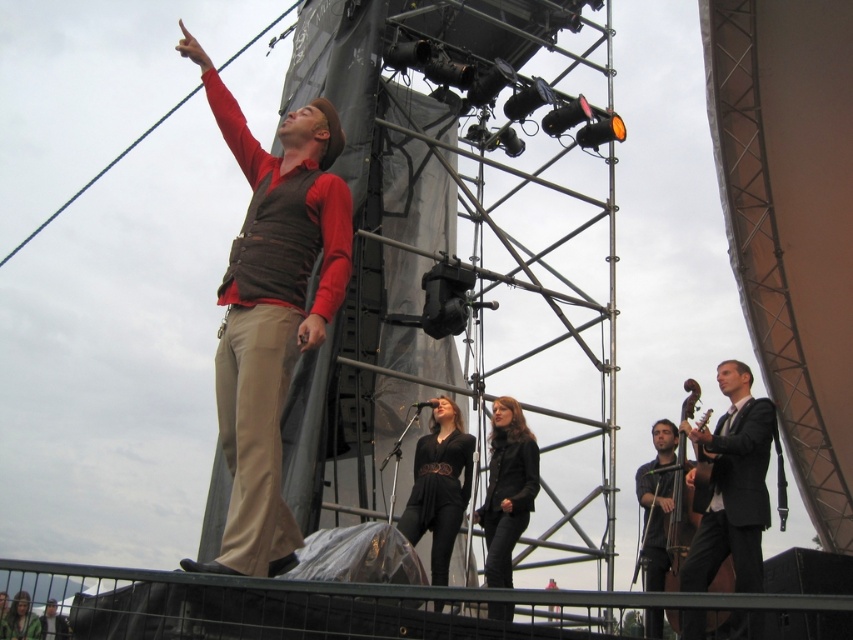
Question: Is matte brown vest at upper left behind black suit at right?

Choices:
 (A) no
 (B) yes

Answer: (A)

Question: Which point is closer to the camera taking this photo?

Choices:
 (A) (257, 554)
 (B) (32, 630)
 (C) (403, 529)
 (D) (675, 522)

Answer: (A)

Question: Does black suit at right appear on the right side of dark brown wood cello at lower right?

Choices:
 (A) yes
 (B) no

Answer: (A)

Question: Considering the real-world distances, which object is farthest from the wooden polished bass at right?

Choices:
 (A) green fabric jacket at center
 (B) black leather jacket at center

Answer: (A)

Question: Which of the following is the closest to the observer?

Choices:
 (A) (646, 547)
 (B) (508, 611)
 (C) (20, 621)
 (D) (270, 262)

Answer: (D)

Question: Is matte brown vest at upper left wider than black leather jacket at center?

Choices:
 (A) no
 (B) yes

Answer: (B)